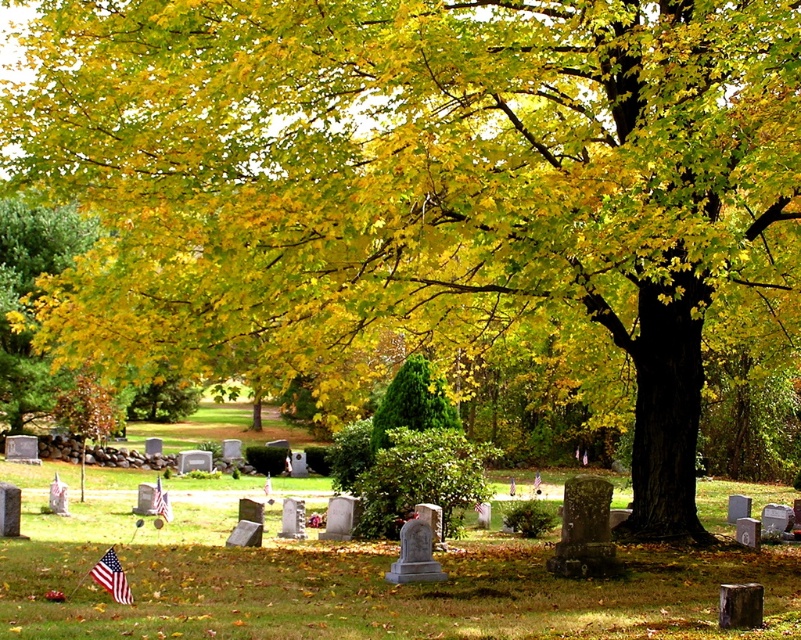
This screenshot has height=640, width=801. Describe the element at coordinates (413, 403) in the screenshot. I see `green textured evergreen tree at center` at that location.

Find the location of a particular element. Image resolution: width=801 pixels, height=640 pixels. green textured evergreen tree at center is located at coordinates (413, 403).

Measure the distance between green textured evergreen tree at center and camera.

green textured evergreen tree at center and camera are 31.20 meters apart.

At what (x,y) coordinates should I click in order to perform the action: click on green textured evergreen tree at center. Please return your answer as a coordinate pair (x, y). This screenshot has width=801, height=640. Looking at the image, I should click on (413, 403).

Does green textured evergreen tree at center have a greater height compared to american flag at center?

No.

Between green textured evergreen tree at center and american flag at center, which one is positioned lower?

Positioned lower is american flag at center.

Which is in front, point (400, 406) or point (157, 509)?

Point (157, 509)

The height and width of the screenshot is (640, 801). What are the coordinates of `green textured evergreen tree at center` in the screenshot? It's located at (413, 403).

Who is taller, american flag at lower left or american flag at center?

american flag at center is taller.

Describe the element at coordinates (111, 577) in the screenshot. I see `american flag at lower left` at that location.

The image size is (801, 640). In order to click on american flag at lower left in this screenshot , I will do `click(111, 577)`.